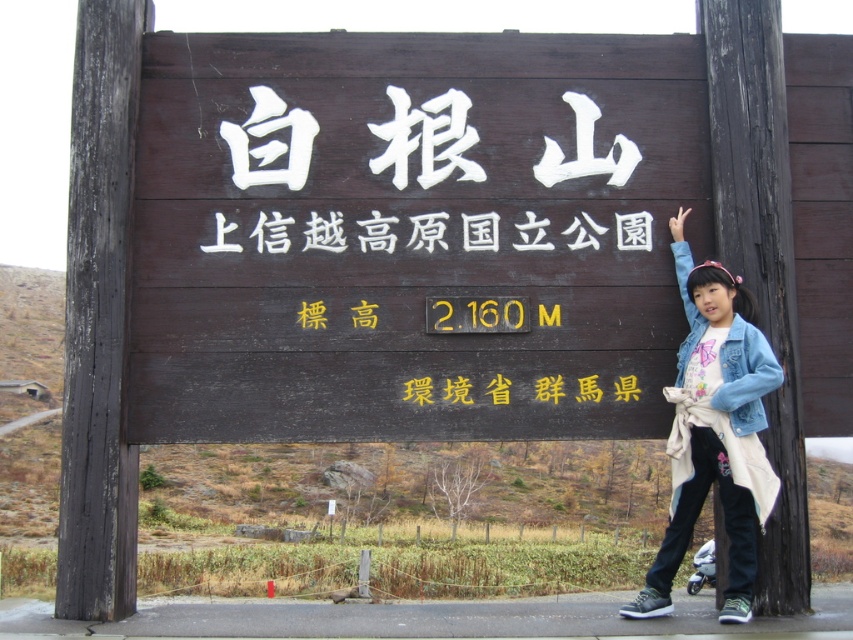
Question: Which object is closer to the camera taking this photo?

Choices:
 (A) dark wood post at right
 (B) white wood sign at center
 (C) dark wood sign at center

Answer: (A)

Question: Considering the relative positions of dark wood post at right and denim jacket at right in the image provided, where is dark wood post at right located with respect to denim jacket at right?

Choices:
 (A) left
 (B) right

Answer: (B)

Question: From the image, what is the correct spatial relationship of denim jacket at right in relation to white wood sign at center?

Choices:
 (A) right
 (B) left

Answer: (A)

Question: Among these points, which one is farthest from the camera?

Choices:
 (A) (341, 228)
 (B) (711, 291)

Answer: (A)

Question: Which object is positioned closest to the denim jacket at right?

Choices:
 (A) dark wood post at right
 (B) dark wood sign at center
 (C) white wood sign at center

Answer: (A)

Question: Is dark wood sign at center further to camera compared to dark wood post at right?

Choices:
 (A) yes
 (B) no

Answer: (A)